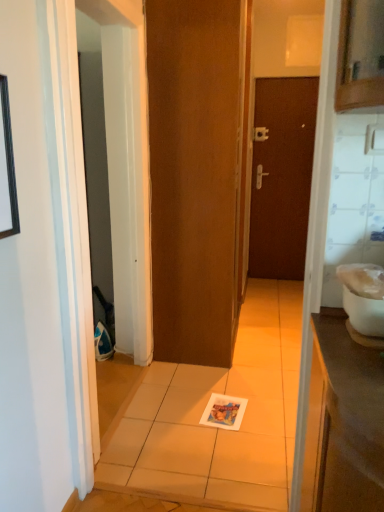
At what (x,y) coordinates should I click in order to perform the action: click on vacant area on top of brown matte door at center, the 2th door in the front-to-back sequence (from a real-world perspective). Please return your answer as a coordinate pair (x, y). The width and height of the screenshot is (384, 512). Looking at the image, I should click on (284, 78).